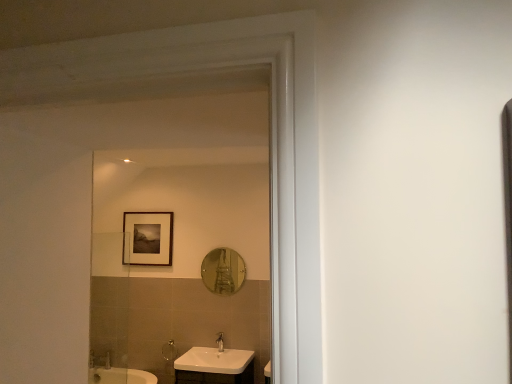
This screenshot has width=512, height=384. What do you see at coordinates (147, 238) in the screenshot?
I see `matte black picture frame at upper center` at bounding box center [147, 238].

This screenshot has height=384, width=512. What do you see at coordinates (220, 342) in the screenshot?
I see `silver metallic faucet at lower center` at bounding box center [220, 342].

This screenshot has height=384, width=512. What are the coordinates of `matte white shower at lower left` in the screenshot? It's located at (169, 350).

Between point (242, 363) and point (234, 283), which one is positioned in front?

The point (242, 363) is closer.

Between white glossy sink at lower center and shiny silver mirror at center, which one has larger width?

white glossy sink at lower center.

Is white glossy sink at lower center spatially inside shiny silver mirror at center, or outside of it?

white glossy sink at lower center lies outside shiny silver mirror at center.

From their relative heights in the image, would you say white glossy sink at lower center is taller or shorter than shiny silver mirror at center?

Clearly, white glossy sink at lower center is shorter compared to shiny silver mirror at center.

Which is in front, shiny silver mirror at center or matte white shower at lower left?

shiny silver mirror at center is in front.

Can matte white shower at lower left be found inside shiny silver mirror at center?

No, matte white shower at lower left is not surrounded by shiny silver mirror at center.

Consider the image. How many degrees apart are the facing directions of shiny silver mirror at center and matte white shower at lower left?

shiny silver mirror at center and matte white shower at lower left are facing 0.00366 degrees away from each other.

In the scene shown: Is shiny silver mirror at center facing away from matte white shower at lower left?

No, shiny silver mirror at center is not facing away from matte white shower at lower left.

From the picture: Visually, is silver metallic faucet at lower center positioned to the left or to the right of shiny silver mirror at center?

Based on their positions, silver metallic faucet at lower center is located to the left of shiny silver mirror at center.

Is silver metallic faucet at lower center positioned with its back to shiny silver mirror at center?

That's not correct — silver metallic faucet at lower center is not looking away from shiny silver mirror at center.

Is silver metallic faucet at lower center positioned far away from shiny silver mirror at center?

They are positioned close to each other.

Can you confirm if matte black picture frame at upper center is smaller than shiny silver mirror at center?

No, matte black picture frame at upper center is not smaller than shiny silver mirror at center.

Does point (138, 218) lie in front of point (220, 281)?

That is False.

From a real-world perspective, which is physically below, matte black picture frame at upper center or shiny silver mirror at center?

In real-world perspective, shiny silver mirror at center is lower.

From the image's perspective, is matte black picture frame at upper center positioned above or below shiny silver mirror at center?

matte black picture frame at upper center is above shiny silver mirror at center.

Between point (225, 370) and point (128, 249), which one is positioned in front?

The point (225, 370) is closer.

Is white glossy sink at lower center shorter than matte black picture frame at upper center?

Indeed, white glossy sink at lower center has a lesser height compared to matte black picture frame at upper center.

Considering the relative sizes of white glossy sink at lower center and matte black picture frame at upper center in the image provided, is white glossy sink at lower center bigger than matte black picture frame at upper center?

Correct, white glossy sink at lower center is larger in size than matte black picture frame at upper center.

Can you tell me how much white glossy sink at lower center and matte black picture frame at upper center differ in facing direction?

The angular difference between white glossy sink at lower center and matte black picture frame at upper center is 0.00273 degrees.

Considering the relative sizes of matte white shower at lower left and shiny silver mirror at center in the image provided, is matte white shower at lower left wider than shiny silver mirror at center?

Indeed, matte white shower at lower left has a greater width compared to shiny silver mirror at center.

From a real-world perspective, is matte white shower at lower left above or below shiny silver mirror at center?

In terms of real-world spatial position, matte white shower at lower left is below shiny silver mirror at center.

Can you tell me how much matte white shower at lower left and shiny silver mirror at center differ in facing direction?

The angular difference between matte white shower at lower left and shiny silver mirror at center is 0.00366 degrees.

Looking at the image, does matte white shower at lower left seem bigger or smaller compared to shiny silver mirror at center?

In the image, matte white shower at lower left appears to be smaller than shiny silver mirror at center.

Would you say shiny silver mirror at center is inside or outside matte black picture frame at upper center?

shiny silver mirror at center is not inside matte black picture frame at upper center, it's outside.

Does point (237, 253) come behind point (124, 245)?

No.

Where is `mirror in front of the matte black picture frame at upper center`? mirror in front of the matte black picture frame at upper center is located at coordinates tap(223, 271).

Is shiny silver mirror at center with matte black picture frame at upper center?

No.

Find the location of a particular element. Image resolution: width=512 pixels, height=384 pixels. mirror above the white glossy sink at lower center (from a real-world perspective) is located at coordinates (223, 271).

Where is `shower below the shiny silver mirror at center (from the image's perspective)`? This screenshot has width=512, height=384. shower below the shiny silver mirror at center (from the image's perspective) is located at coordinates (169, 350).

Based on their spatial positions, is matte black picture frame at upper center or matte white shower at lower left closer to silver metallic faucet at lower center?

Based on the image, matte white shower at lower left appears to be nearer to silver metallic faucet at lower center.

Considering their positions, is white glossy sink at lower center positioned further to matte black picture frame at upper center than shiny silver mirror at center?

Based on the image, white glossy sink at lower center appears to be further to matte black picture frame at upper center.

Based on their spatial positions, is matte white shower at lower left or silver metallic faucet at lower center further from white glossy sink at lower center?

matte white shower at lower left is positioned further to the anchor white glossy sink at lower center.

Considering their positions, is matte black picture frame at upper center positioned closer to white glossy sink at lower center than silver metallic faucet at lower center?

The object closer to white glossy sink at lower center is silver metallic faucet at lower center.

When comparing their distances from matte white shower at lower left, does white glossy sink at lower center or silver metallic faucet at lower center seem closer?

silver metallic faucet at lower center lies closer to matte white shower at lower left than the other object.

Considering their positions, is white glossy sink at lower center positioned further to shiny silver mirror at center than silver metallic faucet at lower center?

white glossy sink at lower center is positioned further to the anchor shiny silver mirror at center.

Which object lies nearer to the anchor point matte white shower at lower left, matte black picture frame at upper center or silver metallic faucet at lower center?

Based on the image, silver metallic faucet at lower center appears to be nearer to matte white shower at lower left.

Based on their spatial positions, is matte white shower at lower left or matte black picture frame at upper center further from silver metallic faucet at lower center?

matte black picture frame at upper center.

The height and width of the screenshot is (384, 512). Find the location of `sink that lies between matte black picture frame at upper center and matte white shower at lower left from top to bottom`. sink that lies between matte black picture frame at upper center and matte white shower at lower left from top to bottom is located at coordinates (215, 365).

At what (x,y) coordinates should I click in order to perform the action: click on mirror that lies between matte black picture frame at upper center and matte white shower at lower left from top to bottom. Please return your answer as a coordinate pair (x, y). The image size is (512, 384). Looking at the image, I should click on 223,271.

Where is `mirror between matte black picture frame at upper center and silver metallic faucet at lower center from top to bottom`? mirror between matte black picture frame at upper center and silver metallic faucet at lower center from top to bottom is located at coordinates (223, 271).

I want to click on tap between shiny silver mirror at center and matte white shower at lower left vertically, so click(x=220, y=342).